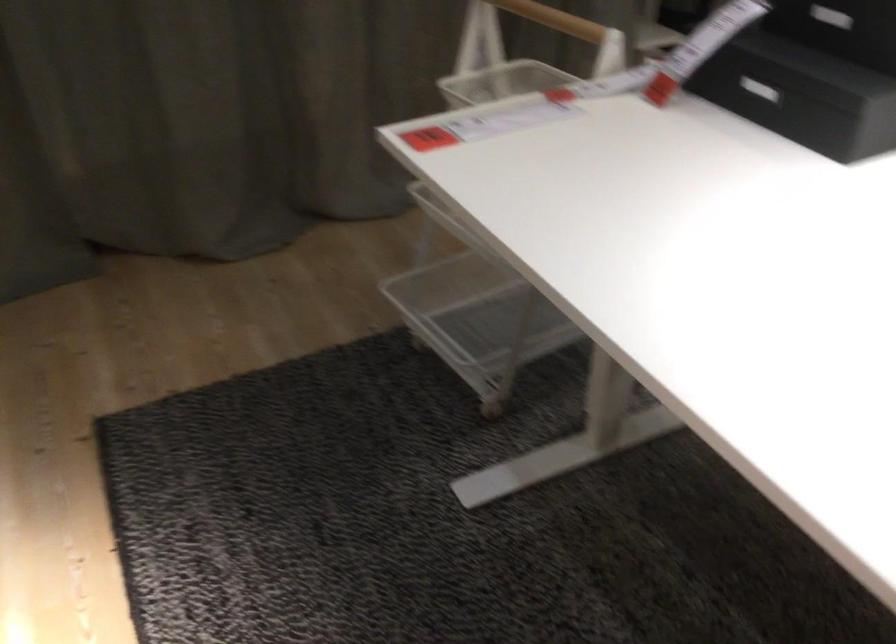
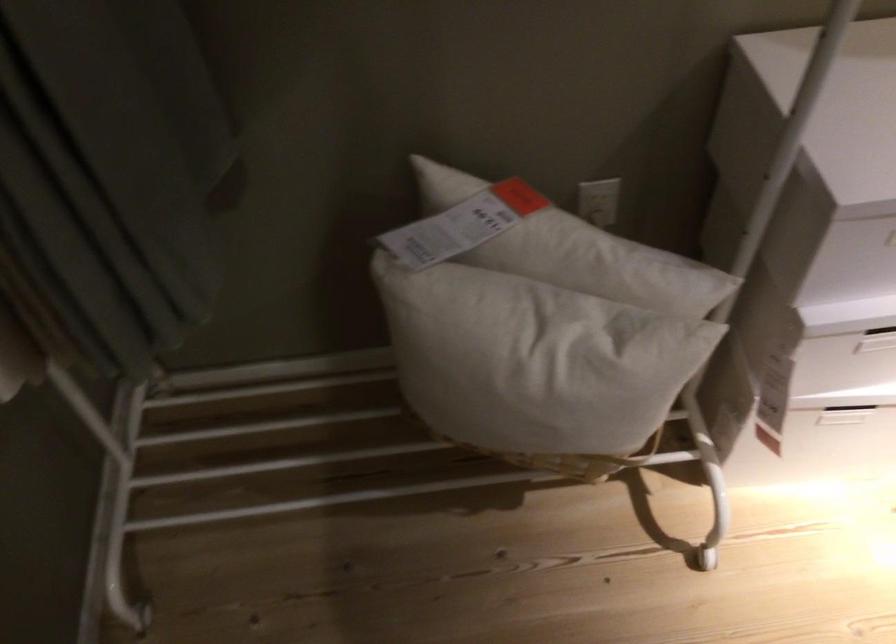
First-person continuous shooting, in which direction is the camera rotating?

The camera rotated toward left-down.